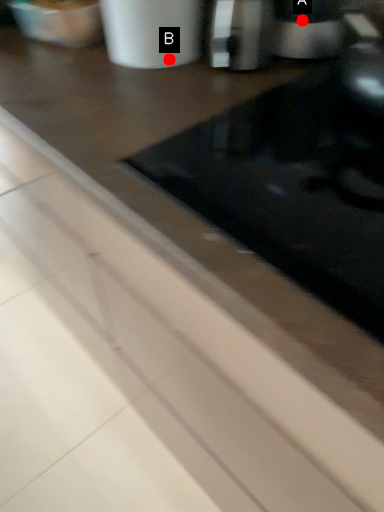
Question: Two points are circled on the image, labeled by A and B beside each circle. Among these points, which one is nearest to the camera?

Choices:
 (A) A is closer
 (B) B is closer

Answer: (A)